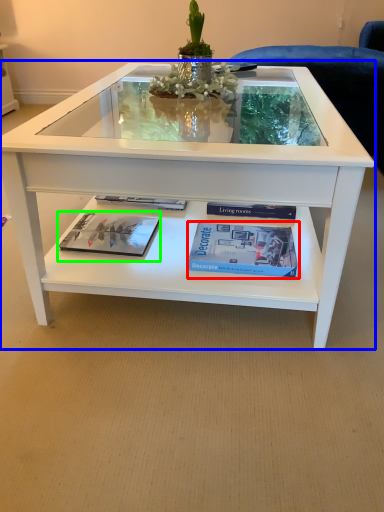
Question: Based on their relative distances, which object is farther from paperback book (highlighted by a red box)? Choose from coffee table (highlighted by a blue box) and magazine (highlighted by a green box).

Choices:
 (A) coffee table
 (B) magazine

Answer: (B)